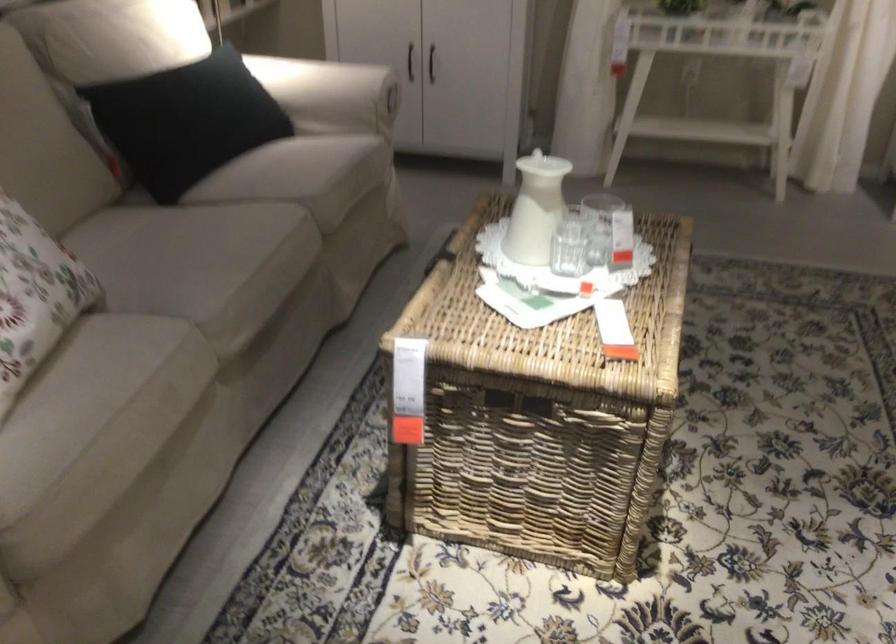
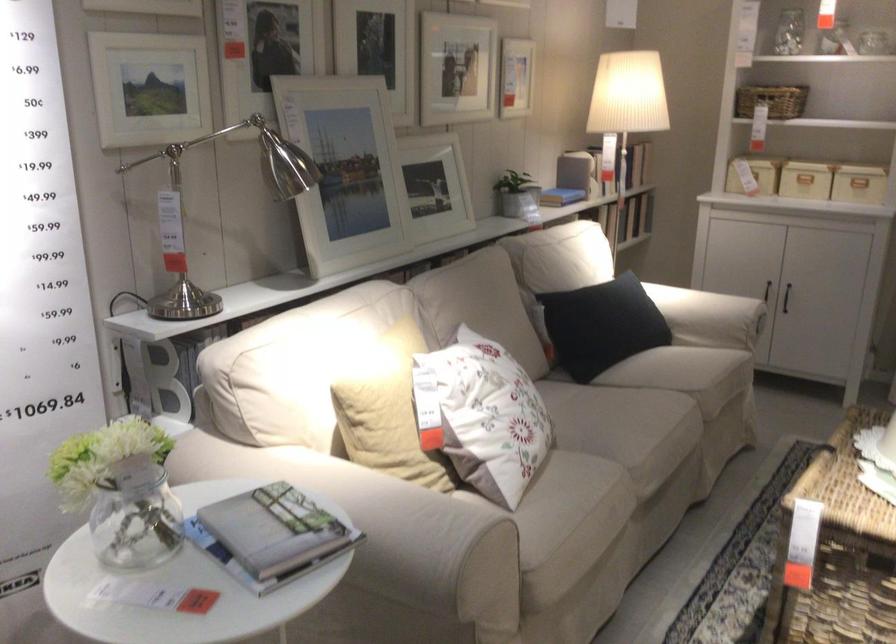
In the second image, find the point that corresponds to (x=177, y=131) in the first image.

(600, 325)